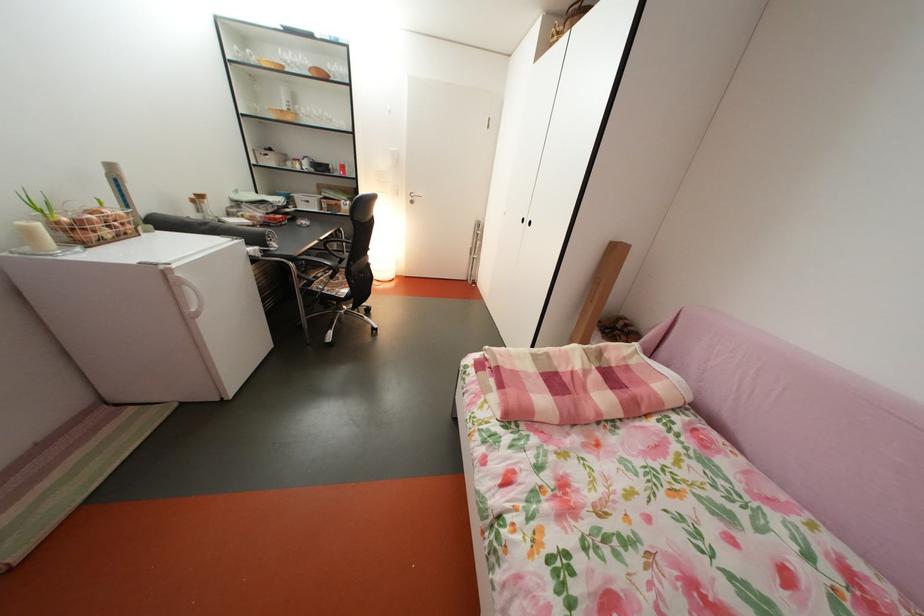
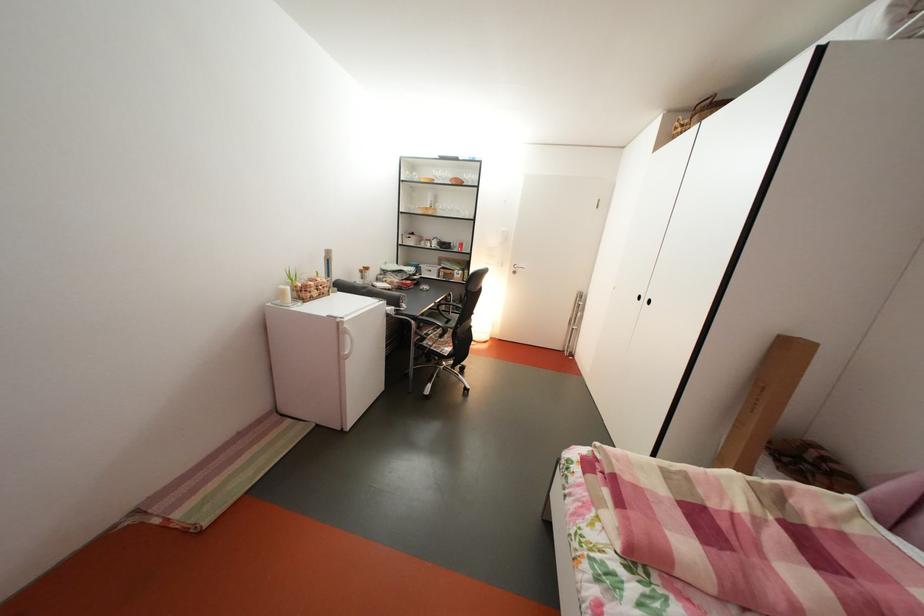
Which direction would the cameraman need to move to produce the second image?

The cameraman moved toward left, backward.